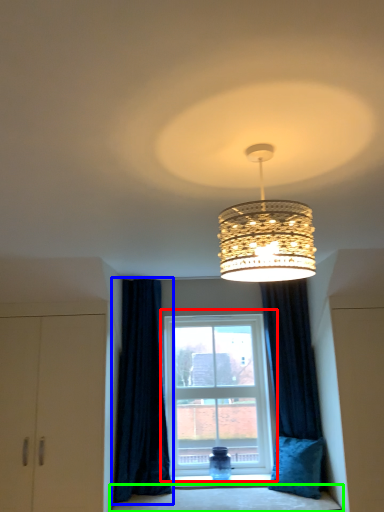
Question: Considering the real-world distances, which object is farthest from window (highlighted by a red box)? curtain (highlighted by a blue box) or bedding (highlighted by a green box)?

Choices:
 (A) curtain
 (B) bedding

Answer: (B)